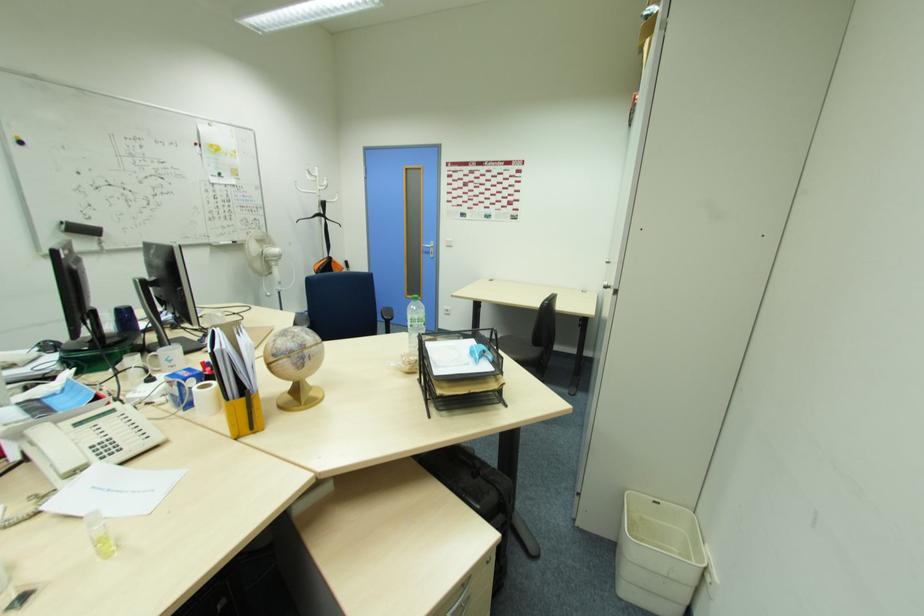
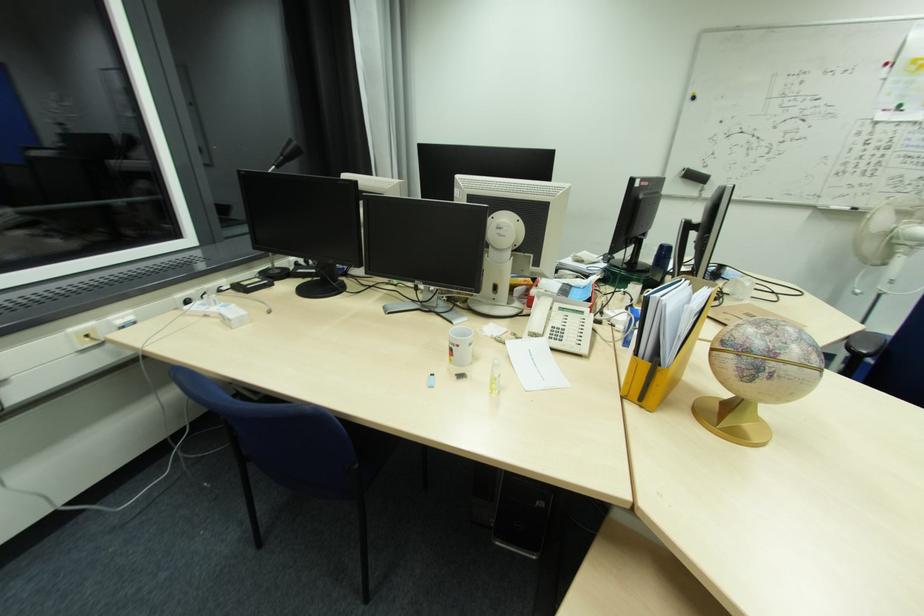
How did the camera likely rotate?

The camera's rotation is toward left-down.